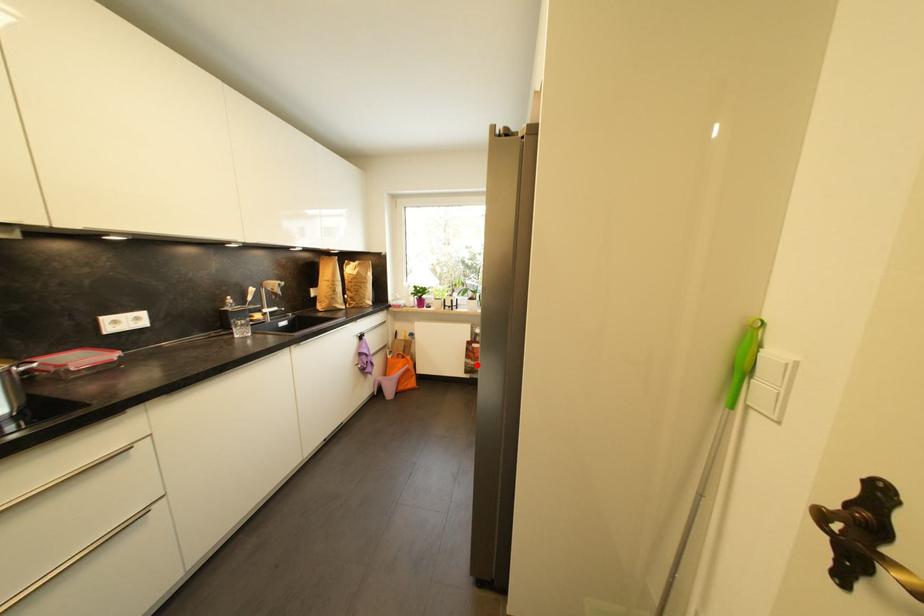
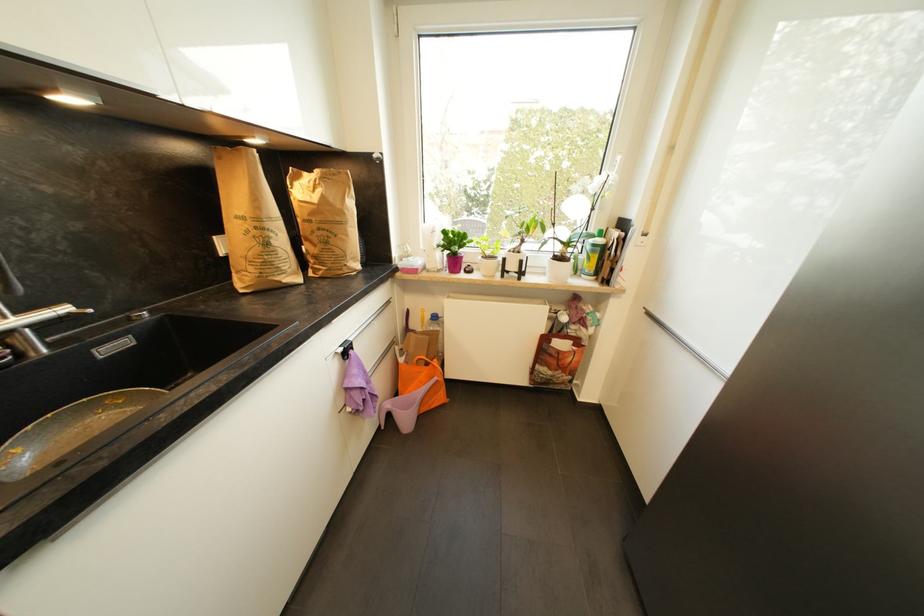
Question: A red point is marked in image1. In image2, is the corresponding 3D point closer to the camera or farther? Reply with the corresponding letter.

Choices:
 (A) The corresponding 3D point is closer.
 (B) The corresponding 3D point is farther.

Answer: (A)